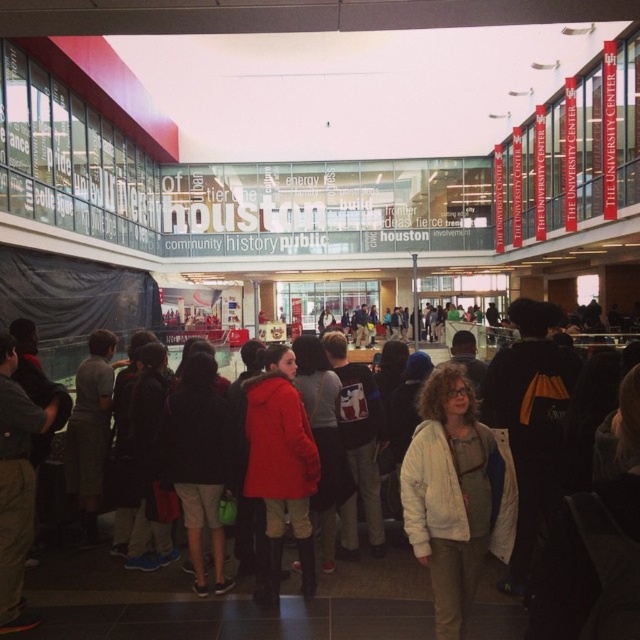
Question: Can you confirm if matte red coat at center is bigger than red jacket at center?

Choices:
 (A) no
 (B) yes

Answer: (B)

Question: Which object appears farthest from the camera in this image?

Choices:
 (A) white cotton jacket at center
 (B) matte red coat at center
 (C) red jacket at center

Answer: (C)

Question: Which of the following is the farthest from the observer?

Choices:
 (A) white cotton jacket at center
 (B) red jacket at center
 (C) matte red coat at center

Answer: (B)

Question: Observing the image, what is the correct spatial positioning of white cotton jacket at center in reference to red jacket at center?

Choices:
 (A) below
 (B) above

Answer: (B)

Question: Does white cotton jacket at center appear on the right side of red jacket at center?

Choices:
 (A) no
 (B) yes

Answer: (B)

Question: Considering the real-world distances, which object is farthest from the matte red coat at center?

Choices:
 (A) white cotton jacket at center
 (B) red jacket at center

Answer: (A)